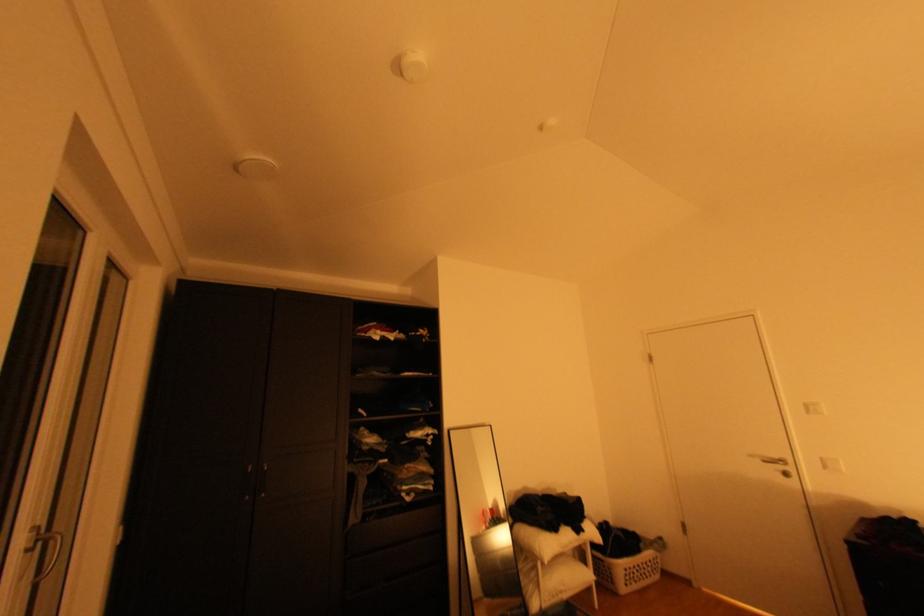
You are a GUI agent. You are given a task and a screenshot of the screen. Output one action in this format:
    pyautogui.click(x=<x>, y=<y>)
    Task: Click on the glass door handle
    Image resolution: width=924 pixels, height=616 pixels.
    Given the screenshot: What is the action you would take?
    pyautogui.click(x=44, y=549)